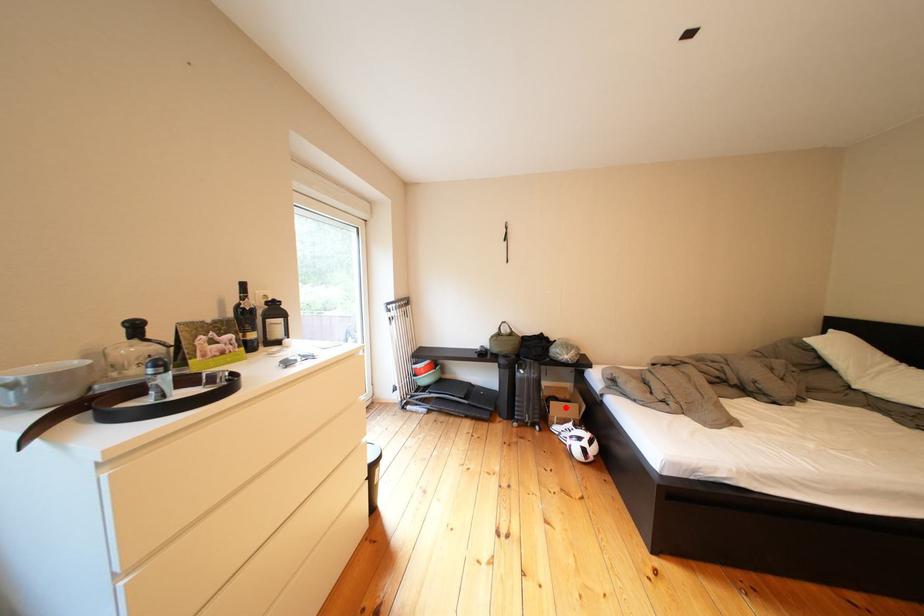
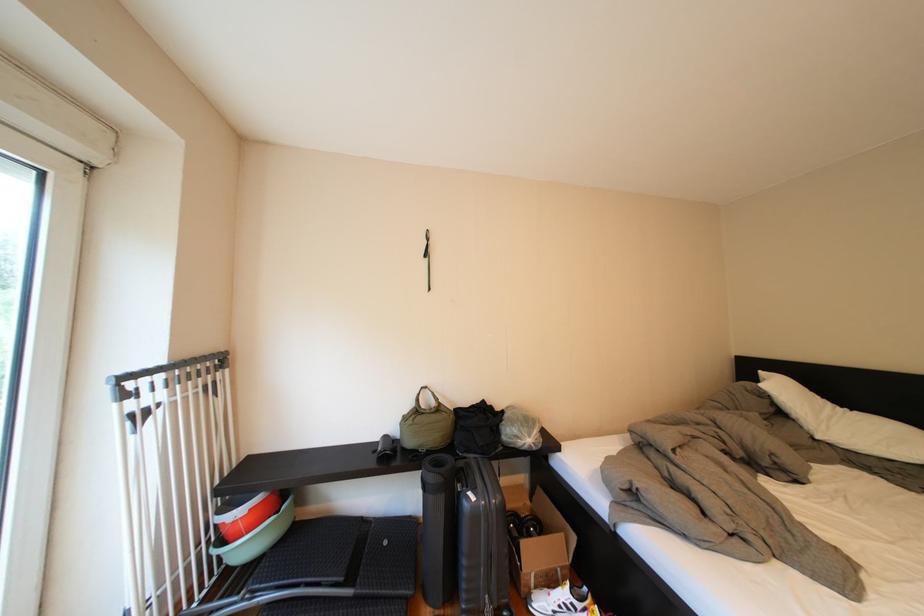
Find the pixel in the second image that matches the highlighted location in the first image.

(538, 548)